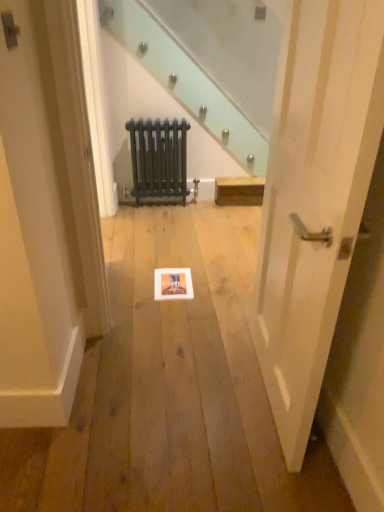
At what (x,y) coordinates should I click in order to perform the action: click on white wood door at center. Please return your answer as a coordinate pair (x, y). This screenshot has height=512, width=384. Looking at the image, I should click on (314, 198).

What is the approximate width of white wood door at center?

It is 5.91 inches.

This screenshot has width=384, height=512. What do you see at coordinates (314, 198) in the screenshot?
I see `white wood door at center` at bounding box center [314, 198].

This screenshot has width=384, height=512. Find the location of `matte black radiator at center`. matte black radiator at center is located at coordinates (158, 158).

This screenshot has width=384, height=512. Describe the element at coordinates (158, 158) in the screenshot. I see `matte black radiator at center` at that location.

At what (x,y) coordinates should I click in order to perform the action: click on white wood door at center. Please return your answer as a coordinate pair (x, y). Looking at the image, I should click on (314, 198).

Can you confirm if matte black radiator at center is positioned to the left of white wood door at center?

Yes.

Which object is closer to the camera, matte black radiator at center or white wood door at center?

white wood door at center is closer to the camera.

Does point (172, 166) appear closer or farther from the camera than point (341, 298)?

Point (172, 166) is positioned farther from the camera compared to point (341, 298).

From the picture: From the image's perspective, which one is positioned lower, matte black radiator at center or white wood door at center?

white wood door at center is shown below in the image.

From a real-world perspective, relative to white wood door at center, is matte black radiator at center vertically above or below?

matte black radiator at center is situated lower than white wood door at center in the real world.

In the scene shown: Considering the sizes of matte black radiator at center and white wood door at center in the image, is matte black radiator at center wider or thinner than white wood door at center?

In the image, matte black radiator at center appears to be more narrow than white wood door at center.

In terms of height, does matte black radiator at center look taller or shorter compared to white wood door at center?

In the image, matte black radiator at center appears to be shorter than white wood door at center.

Between matte black radiator at center and white wood door at center, which one has larger size?

Bigger between the two is white wood door at center.

Could white wood door at center be considered to be inside matte black radiator at center?

No, white wood door at center is not inside matte black radiator at center.

Is there a large distance between matte black radiator at center and white wood door at center?

That's right, there is a large distance between matte black radiator at center and white wood door at center.

Is matte black radiator at center positioned with its back to white wood door at center?

No, matte black radiator at center is not facing away from white wood door at center.

How many degrees apart are the facing directions of matte black radiator at center and white wood door at center?

matte black radiator at center and white wood door at center are facing 90 degrees away from each other.

Find the location of a particular element. Image resolution: width=384 pixels, height=512 pixels. door on the right of the matte black radiator at center is located at coordinates (314, 198).

Is white wood door at center to the right of matte black radiator at center from the viewer's perspective?

Indeed, white wood door at center is positioned on the right side of matte black radiator at center.

Is white wood door at center in front of or behind matte black radiator at center in the image?

In the image, white wood door at center appears in front of matte black radiator at center.

Considering the points (361, 147) and (154, 126), which point is in front, point (361, 147) or point (154, 126)?

The point (361, 147) is in front.

From the image's perspective, is white wood door at center located beneath matte black radiator at center?

Yes, from the image's perspective, white wood door at center is beneath matte black radiator at center.

Based on the photo, from a real-world perspective, does white wood door at center sit lower than matte black radiator at center?

Actually, white wood door at center is physically above matte black radiator at center in the real world.

Consider the image. Does white wood door at center have a greater width compared to matte black radiator at center?

Indeed, white wood door at center has a greater width compared to matte black radiator at center.

Who is shorter, white wood door at center or matte black radiator at center?

matte black radiator at center.

Considering the relative sizes of white wood door at center and matte black radiator at center in the image provided, is white wood door at center bigger than matte black radiator at center?

Correct, white wood door at center is larger in size than matte black radiator at center.

Is matte black radiator at center inside white wood door at center?

No, matte black radiator at center is not a part of white wood door at center.

Is white wood door at center not near matte black radiator at center?

Yes.

Does white wood door at center turn towards matte black radiator at center?

No, white wood door at center is not oriented towards matte black radiator at center.

Find the location of a particular element. radiator that appears above the white wood door at center (from the image's perspective) is located at coordinates (158, 158).

I want to click on radiator lying above the white wood door at center (from the image's perspective), so click(158, 158).

You are a GUI agent. You are given a task and a screenshot of the screen. Output one action in this format:
    pyautogui.click(x=<x>, y=<y>)
    Task: Click on the door in front of the matte black radiator at center
    The image size is (384, 512).
    Given the screenshot: What is the action you would take?
    pyautogui.click(x=314, y=198)